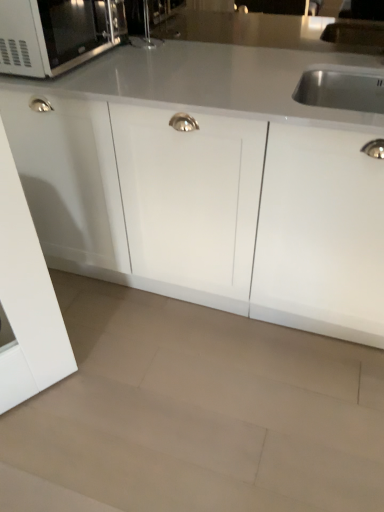
Locate an element on the screen. The height and width of the screenshot is (512, 384). matte black microwave at upper left is located at coordinates (57, 34).

Can you tell me how much matte black microwave at upper left and white glossy cabinet at center differ in facing direction?

There is a 88.1-degree angle between the facing directions of matte black microwave at upper left and white glossy cabinet at center.

Is matte black microwave at upper left further to camera compared to white glossy cabinet at center?

Yes, it is behind white glossy cabinet at center.

Is matte black microwave at upper left next to white glossy cabinet at center?

matte black microwave at upper left and white glossy cabinet at center are not in contact.

Based on their positions, is beige polished granite at lower center located to the left or right of matte black microwave at upper left?

In the image, beige polished granite at lower center appears on the right side of matte black microwave at upper left.

What are the coordinates of `granite on the right of matte black microwave at upper left` in the screenshot? It's located at (195, 413).

From a real-world perspective, which object rests below the other?

In real-world perspective, beige polished granite at lower center is lower.

Who is bigger, beige polished granite at lower center or matte black microwave at upper left?

beige polished granite at lower center.

Considering the relative sizes of matte black microwave at upper left and beige polished granite at lower center in the image provided, is matte black microwave at upper left wider than beige polished granite at lower center?

In fact, matte black microwave at upper left might be narrower than beige polished granite at lower center.

Is matte black microwave at upper left positioned with its back to beige polished granite at lower center?

No, matte black microwave at upper left is not facing away from beige polished granite at lower center.

Can you confirm if matte black microwave at upper left is bigger than beige polished granite at lower center?

No, matte black microwave at upper left is not bigger than beige polished granite at lower center.

Choose the correct answer: Is beige polished granite at lower center inside white glossy cabinet at center or outside it?

Answer: beige polished granite at lower center lies outside white glossy cabinet at center.

Which is more to the left, beige polished granite at lower center or white glossy cabinet at center?

beige polished granite at lower center.

Consider the image. Considering the sizes of beige polished granite at lower center and white glossy cabinet at center in the image, is beige polished granite at lower center taller or shorter than white glossy cabinet at center?

Considering their sizes, beige polished granite at lower center has less height than white glossy cabinet at center.

From the image's perspective, is white glossy cabinet at center located above beige polished granite at lower center?

Correct, white glossy cabinet at center appears higher than beige polished granite at lower center in the image.

Measure the distance between white glossy cabinet at center and beige polished granite at lower center.

white glossy cabinet at center and beige polished granite at lower center are 19.46 inches apart.

Is white glossy cabinet at center oriented away from beige polished granite at lower center?

white glossy cabinet at center does not have its back to beige polished granite at lower center.

Between white glossy cabinet at center and beige polished granite at lower center, which one has less height?

beige polished granite at lower center is shorter.

From a real-world perspective, is white glossy cabinet at center located beneath matte black microwave at upper left?

Yes, from a real-world perspective, white glossy cabinet at center is under matte black microwave at upper left.

In terms of width, does white glossy cabinet at center look wider or thinner when compared to matte black microwave at upper left?

Clearly, white glossy cabinet at center has more width compared to matte black microwave at upper left.

Is the depth of white glossy cabinet at center less than that of matte black microwave at upper left?

Yes.

Does point (240, 250) come closer to viewer compared to point (119, 24)?

Yes, point (240, 250) is closer to viewer.

You are a GUI agent. You are given a task and a screenshot of the screen. Output one action in this format:
    pyautogui.click(x=<x>, y=<y>)
    Task: Click on the cabinetry below the matte black microwave at upper left (from a real-world perspective)
    The width and height of the screenshot is (384, 512).
    Given the screenshot: What is the action you would take?
    pyautogui.click(x=209, y=208)

This screenshot has width=384, height=512. I want to click on microwave oven located above the beige polished granite at lower center (from a real-world perspective), so click(x=57, y=34).

Looking at the image, which one is located further to matte black microwave at upper left, beige polished granite at lower center or white glossy cabinet at center?

Based on the image, beige polished granite at lower center appears to be further to matte black microwave at upper left.

Based on their spatial positions, is matte black microwave at upper left or beige polished granite at lower center closer to white glossy cabinet at center?

beige polished granite at lower center.

Considering their positions, is white glossy cabinet at center positioned further to matte black microwave at upper left than beige polished granite at lower center?

beige polished granite at lower center.

Looking at the image, which one is located further to white glossy cabinet at center, beige polished granite at lower center or matte black microwave at upper left?

matte black microwave at upper left.

Looking at the image, which one is located closer to beige polished granite at lower center, matte black microwave at upper left or white glossy cabinet at center?

white glossy cabinet at center is closer to beige polished granite at lower center.

Estimate the real-world distances between objects in this image. Which object is closer to beige polished granite at lower center, white glossy cabinet at center or matte black microwave at upper left?

white glossy cabinet at center is closer to beige polished granite at lower center.

This screenshot has height=512, width=384. I want to click on cabinetry between matte black microwave at upper left and beige polished granite at lower center in the up-down direction, so click(209, 208).